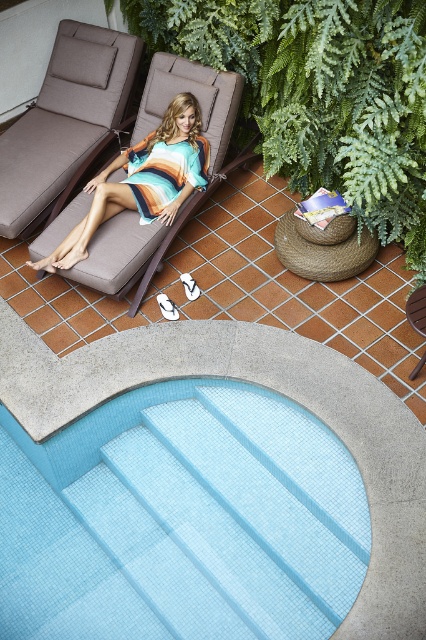
Question: Observing the image, what is the correct spatial positioning of light blue tile swimming pool at lower center in reference to matte brown chaise lounge at upper left?

Choices:
 (A) left
 (B) right

Answer: (B)

Question: Is light blue tile swimming pool at lower center to the left of matte brown chaise lounge at upper left from the viewer's perspective?

Choices:
 (A) no
 (B) yes

Answer: (A)

Question: Among these objects, which one is farthest from the camera?

Choices:
 (A) striped cotton dress at center
 (B) matte brown chaise lounge at upper left

Answer: (B)

Question: Can you confirm if light blue tile swimming pool at lower center is positioned to the right of striped cotton dress at center?

Choices:
 (A) yes
 (B) no

Answer: (A)

Question: Which point is closer to the camera?

Choices:
 (A) (62, 58)
 (B) (339, 536)
 (C) (154, 161)

Answer: (B)

Question: Which of the following is the farthest from the observer?

Choices:
 (A) matte brown chaise lounge at upper left
 (B) green leafy plant at upper center

Answer: (A)